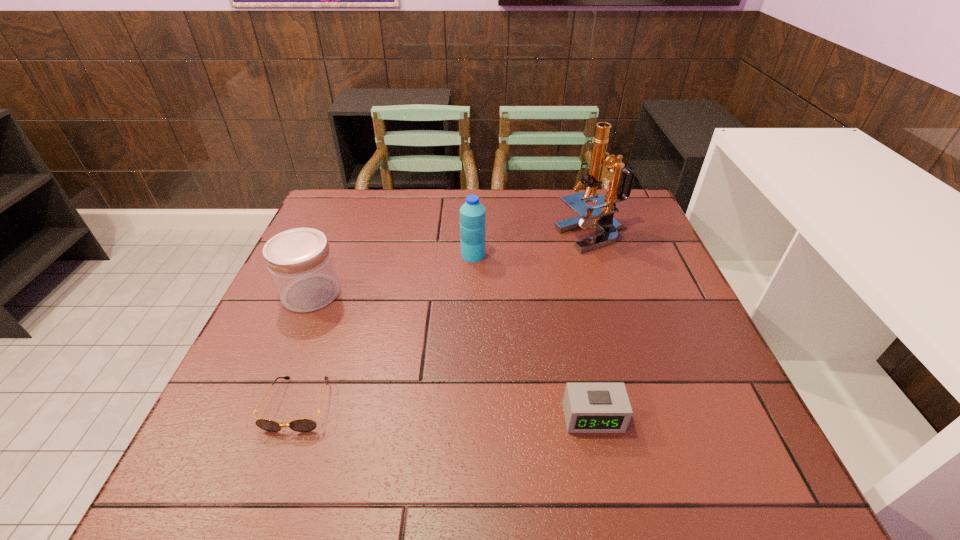
Locate an element on the screen. blank space located on the left of the water bottle is located at coordinates (402, 255).

This screenshot has height=540, width=960. What are the coordinates of `vacant space located on the right of the jar` in the screenshot? It's located at (495, 293).

This screenshot has width=960, height=540. I want to click on free space located on the front-facing side of the second shortest object, so click(x=605, y=471).

Identify the location of vacant area situated on the front-facing side of the sunglasses. The width and height of the screenshot is (960, 540). (271, 484).

Find the location of `object that is at the far edge`. object that is at the far edge is located at coordinates (619, 181).

Identify the location of jar at the left edge. The image size is (960, 540). (300, 263).

Where is `sunglasses that is at the left edge`? sunglasses that is at the left edge is located at coordinates (299, 425).

Where is `object that is at the right edge`? This screenshot has height=540, width=960. object that is at the right edge is located at coordinates (619, 181).

I want to click on object that is at the far right corner, so click(619, 181).

This screenshot has width=960, height=540. In the image, there is a desktop. In order to click on free space at the far edge in this screenshot , I will do `click(500, 230)`.